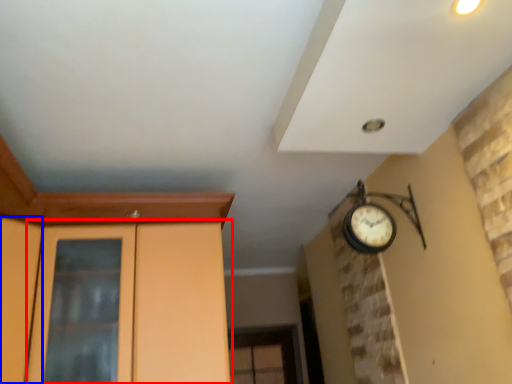
Question: Which object appears closest to the camera in this image, dresser (highlighted by a red box) or door (highlighted by a blue box)?

Choices:
 (A) dresser
 (B) door

Answer: (B)